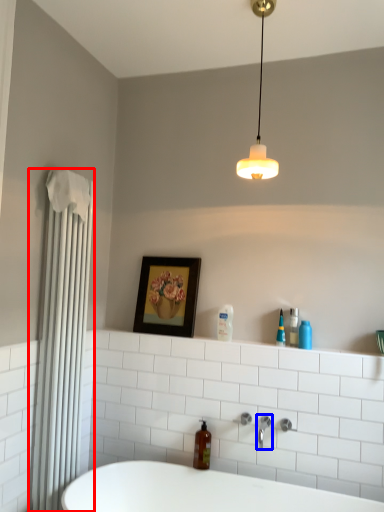
Question: Which object appears closest to the camera in this image, shower curtain (highlighted by a red box) or tap (highlighted by a blue box)?

Choices:
 (A) shower curtain
 (B) tap

Answer: (A)